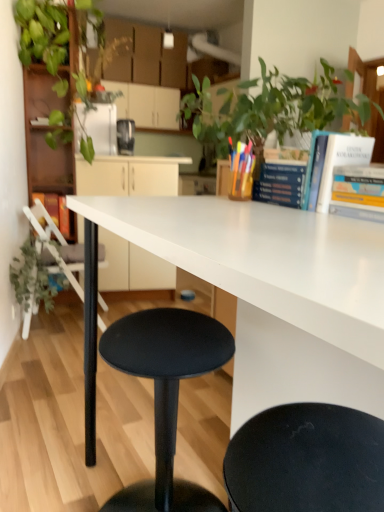
Question: From the image's perspective, is hardcover book at upper right, the second book in the right-to-left sequence, under matte black stool at lower center?

Choices:
 (A) yes
 (B) no

Answer: (B)

Question: Is hardcover book at upper right, placed as the third book when sorted from back to front, aimed at matte black stool at lower center?

Choices:
 (A) yes
 (B) no

Answer: (B)

Question: Is hardcover book at upper right, placed as the third book when sorted from back to front, outside of matte black stool at lower center?

Choices:
 (A) no
 (B) yes

Answer: (B)

Question: From a real-world perspective, is hardcover book at upper right, which is the second book from front to back, located higher than matte black stool at lower center?

Choices:
 (A) no
 (B) yes

Answer: (B)

Question: Is hardcover book at upper right, arranged as the third book when viewed from the left, touching matte black stool at lower center?

Choices:
 (A) yes
 (B) no

Answer: (B)

Question: Can you confirm if hardcover book at upper right, placed as the third book when sorted from back to front, is smaller than matte black stool at lower center?

Choices:
 (A) yes
 (B) no

Answer: (A)

Question: Can you confirm if white matte chair at lower left is bigger than matte white cabinets at center, the 1th cabinetry positioned from the bottom?

Choices:
 (A) yes
 (B) no

Answer: (B)

Question: Could you tell me if white matte chair at lower left is facing matte white cabinets at center, arranged as the 1th cabinetry when viewed from the front?

Choices:
 (A) yes
 (B) no

Answer: (B)

Question: From the image's perspective, is white matte chair at lower left under matte white cabinets at center, positioned as the 2th cabinetry in back-to-front order?

Choices:
 (A) yes
 (B) no

Answer: (A)

Question: Is white matte chair at lower left further to the viewer compared to matte white cabinets at center, the 1th cabinetry positioned from the bottom?

Choices:
 (A) yes
 (B) no

Answer: (B)

Question: Is white matte chair at lower left facing away from matte white cabinets at center, positioned as the 2th cabinetry in back-to-front order?

Choices:
 (A) yes
 (B) no

Answer: (B)

Question: Can you confirm if white matte chair at lower left is positioned to the left of matte white cabinets at center, the 2th cabinetry from the top?

Choices:
 (A) no
 (B) yes

Answer: (B)

Question: Is green matte plant at left facing towards white matte chair at lower left?

Choices:
 (A) no
 (B) yes

Answer: (A)